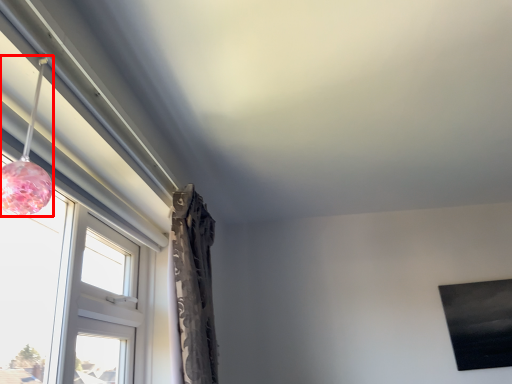
Question: Where is lamp (annotated by the red box) located in relation to window in the image?

Choices:
 (A) left
 (B) right

Answer: (A)